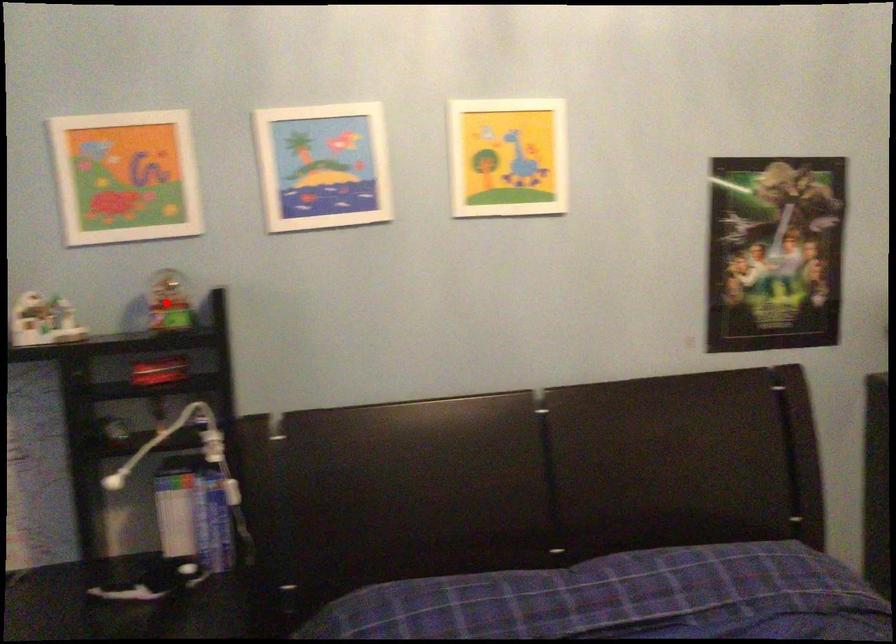
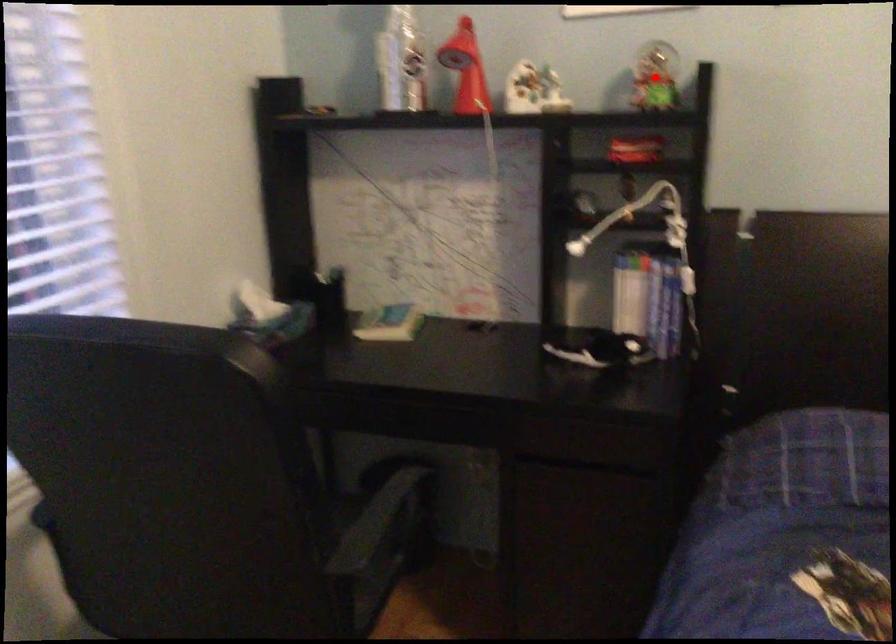
I am providing you with two images of the same scene from different viewpoints. A red point is marked on the first image and another point is marked on the second image. Is the red point in image1 aligned with the point shown in image2?

Yes